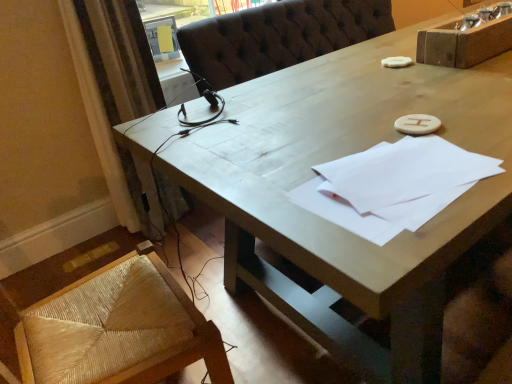
Question: From a real-world perspective, is white paper at center positioned above or below beige textured curtain at left?

Choices:
 (A) below
 (B) above

Answer: (B)

Question: Considering the positions of point (312, 190) and point (88, 9), is point (312, 190) closer or farther from the camera than point (88, 9)?

Choices:
 (A) farther
 (B) closer

Answer: (B)

Question: Considering the positions of white paper at center and beige textured curtain at left in the image, is white paper at center wider or thinner than beige textured curtain at left?

Choices:
 (A) thin
 (B) wide

Answer: (A)

Question: Is beige textured curtain at left wider or thinner than white paper at center?

Choices:
 (A) wide
 (B) thin

Answer: (A)

Question: In the image, is beige textured curtain at left positioned in front of or behind white paper at center?

Choices:
 (A) front
 (B) behind

Answer: (B)

Question: Do you think beige textured curtain at left is within white paper at center, or outside of it?

Choices:
 (A) outside
 (B) inside

Answer: (A)

Question: In terms of size, does beige textured curtain at left appear bigger or smaller than white paper at center?

Choices:
 (A) small
 (B) big

Answer: (B)